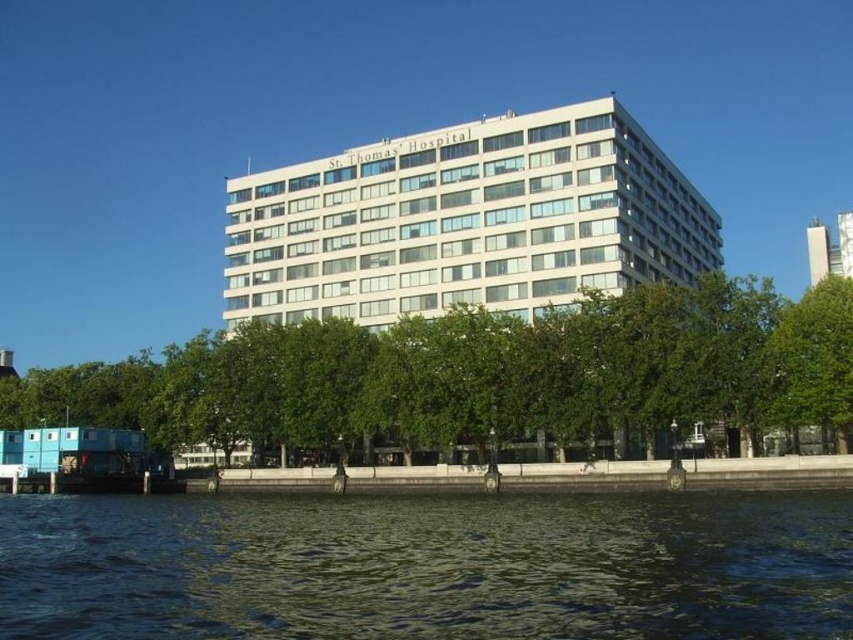
Can you confirm if dark blue water at lower center is thinner than green leafy tree at center?

Correct, dark blue water at lower center's width is less than green leafy tree at center's.

Which is behind, point (199, 628) or point (33, 380)?

Positioned behind is point (33, 380).

This screenshot has width=853, height=640. Find the location of `dark blue water at lower center`. dark blue water at lower center is located at coordinates (427, 566).

Is dark blue water at lower center smaller than white smooth building at center?

Yes, dark blue water at lower center is smaller than white smooth building at center.

Can you confirm if dark blue water at lower center is thinner than white smooth building at center?

Indeed, dark blue water at lower center has a lesser width compared to white smooth building at center.

This screenshot has width=853, height=640. In order to click on dark blue water at lower center in this screenshot , I will do `click(427, 566)`.

This screenshot has width=853, height=640. What are the coordinates of `dark blue water at lower center` in the screenshot? It's located at (427, 566).

Is green leafy tree at center below white smooth building at center?

Yes.

This screenshot has height=640, width=853. What do you see at coordinates (479, 374) in the screenshot? I see `green leafy tree at center` at bounding box center [479, 374].

Which is behind, point (508, 410) or point (608, 132)?

The point (608, 132) is behind.

This screenshot has height=640, width=853. Find the location of `green leafy tree at center`. green leafy tree at center is located at coordinates (479, 374).